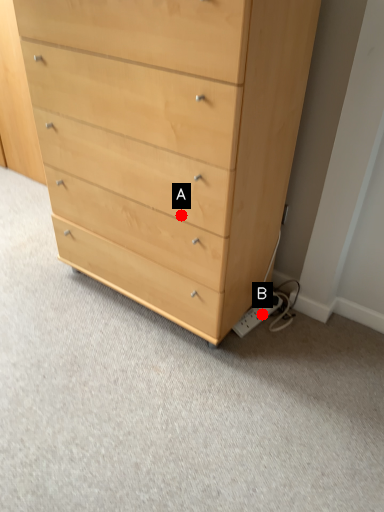
Question: Two points are circled on the image, labeled by A and B beside each circle. Which point is farther to the camera?

Choices:
 (A) A is further
 (B) B is further

Answer: (B)